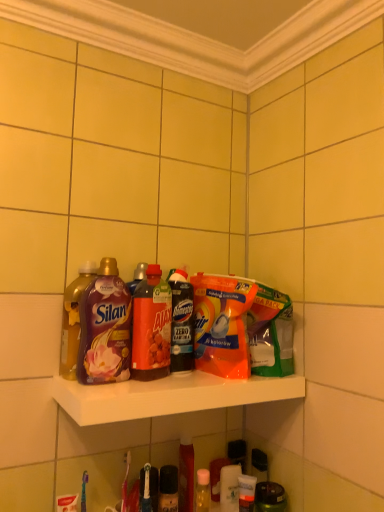
Question: From the image's perspective, is orange plastic dishwashing liquid at center positioned above or below translucent plastic bottle at center, which is the first bottle in right-to-left order?

Choices:
 (A) below
 (B) above

Answer: (A)

Question: Is orange plastic dishwashing liquid at center taller or shorter than translucent plastic bottle at center, which is the first bottle in right-to-left order?

Choices:
 (A) short
 (B) tall

Answer: (A)

Question: Based on their relative distances, which object is nearer to the matte plastic bottle at left, the third bottle in the right-to-left sequence?

Choices:
 (A) translucent orange bottle at center, arranged as the third bottle when viewed from the left
 (B) white glossy shelf at center
 (C) orange plastic dishwashing liquid at center
 (D) translucent plastic bottle at center, which is the first bottle in right-to-left order
 (E) shiny purple bottle at left, acting as the 1th bottle starting from the left

Answer: (A)

Question: Which of these objects is positioned closest to the orange plastic dishwashing liquid at center?

Choices:
 (A) translucent orange bottle at center, arranged as the third bottle when viewed from the left
 (B) matte plastic bottle at left, arranged as the 2th bottle when viewed from the left
 (C) shiny purple bottle at left, marked as the fourth bottle in a right-to-left arrangement
 (D) white glossy shelf at center
 (E) translucent plastic bottle at center, which is the first bottle in right-to-left order

Answer: (E)